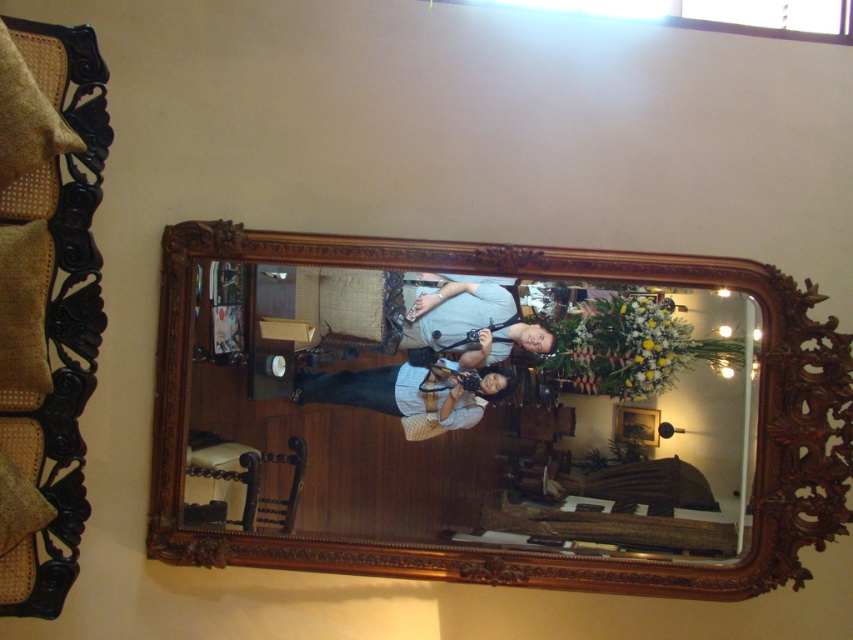
Can you confirm if wooden mirror at center is thinner than matte gray shirt at center?

In fact, wooden mirror at center might be wider than matte gray shirt at center.

Is point (751, 310) behind point (440, 305)?

No, it is not.

At what (x,y) coordinates should I click in order to perform the action: click on wooden mirror at center. Please return your answer as a coordinate pair (x, y). The image size is (853, 640). Looking at the image, I should click on (468, 406).